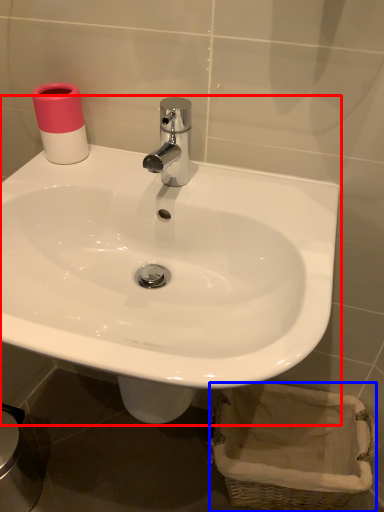
Question: Which object appears farthest to the camera in this image, sink (highlighted by a red box) or basket (highlighted by a blue box)?

Choices:
 (A) sink
 (B) basket

Answer: (B)